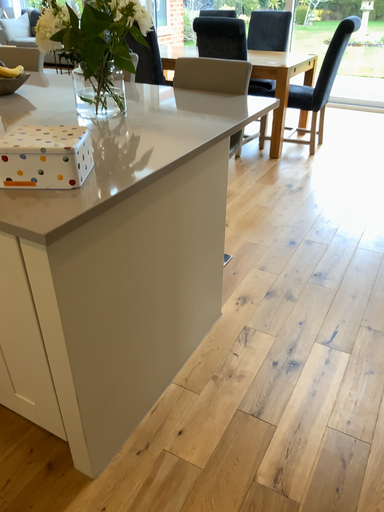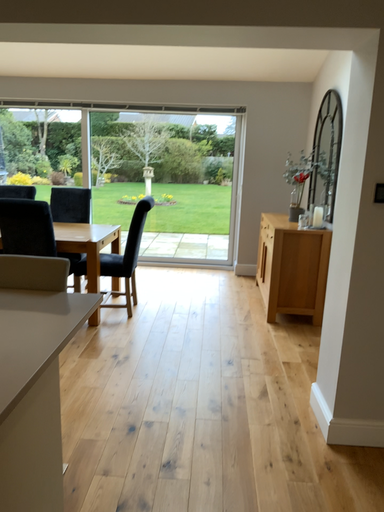
Question: Which way did the camera rotate in the video?

Choices:
 (A) rotated downward
 (B) rotated upward

Answer: (B)